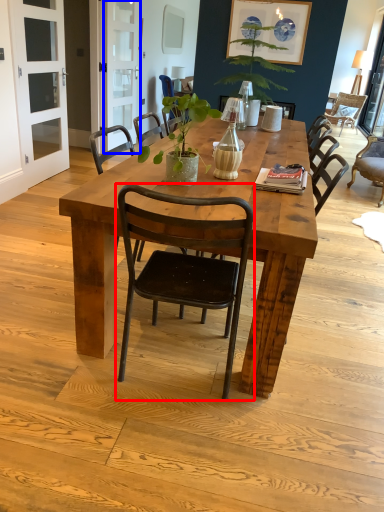
Question: Which point is closer to the camera, chair (highlighted by a red box) or screen door (highlighted by a blue box)?

Choices:
 (A) chair
 (B) screen door

Answer: (A)